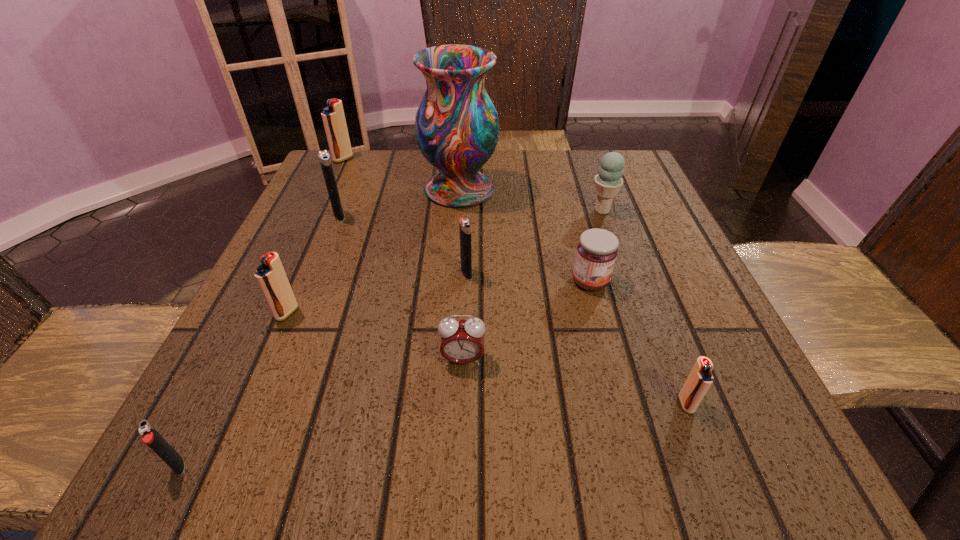
Image resolution: width=960 pixels, height=540 pixels. Identify the location of jam. (597, 250).

You are a GUI agent. You are given a task and a screenshot of the screen. Output one action in this format:
    pyautogui.click(x=<x>, y=<y>)
    Task: Click on the red jam
    This screenshot has height=540, width=960.
    Given the screenshot: What is the action you would take?
    pyautogui.click(x=597, y=250)

At what (x,y) coordinates should I click in order to perform the action: click on pink alarm clock. Please return your answer as a coordinate pair (x, y). Image resolution: width=960 pixels, height=540 pixels. Looking at the image, I should click on click(x=462, y=341).

Find the location of a particular element. the eighth farthest object is located at coordinates (462, 341).

Locate an element on the screen. The image size is (960, 540). the smallest red igniter is located at coordinates (700, 378).

This screenshot has height=540, width=960. I want to click on the fifth farthest igniter, so click(700, 378).

The height and width of the screenshot is (540, 960). What are the coordinates of `the nearest igniter` in the screenshot? It's located at (150, 435).

Find the location of a particular element. This screenshot has height=540, width=960. the nearest black igniter is located at coordinates (150, 435).

I want to click on vacant area situated on the front of the vase, so [x=451, y=314].

At what (x,y) coordinates should I click in order to perform the action: click on vacant space located 0.350m on the front of the farthest object. Please return your answer as a coordinate pair (x, y). The width and height of the screenshot is (960, 540). Looking at the image, I should click on (299, 253).